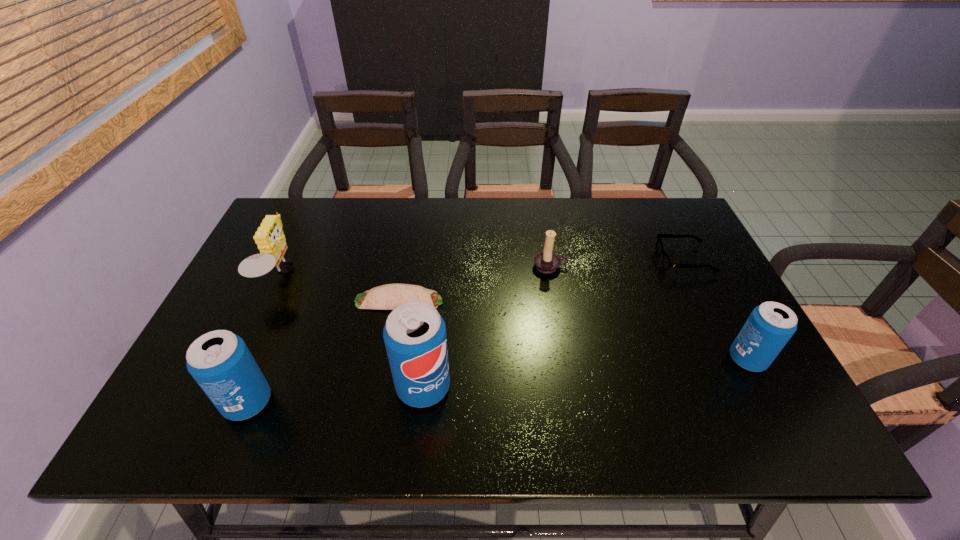
This screenshot has width=960, height=540. What are the coordinates of `the second tallest soda can` in the screenshot? It's located at pos(220,362).

In order to click on the sixth shortest object in this screenshot , I will do `click(220, 362)`.

Where is `the second soda can from right to left`? the second soda can from right to left is located at coordinates (415, 338).

I want to click on the rightmost soda can, so click(769, 327).

Where is `the shortest object`? the shortest object is located at coordinates click(390, 296).

At what (x,y) coordinates should I click in order to perform the action: click on sponge. Please return your answer as a coordinate pair (x, y). Looking at the image, I should click on (269, 237).

In order to click on the fifth object from left to right in this screenshot , I will do `click(547, 262)`.

Identify the location of the sixth tallest object. The height and width of the screenshot is (540, 960). (666, 261).

Locate an element on the screen. free space located on the left of the second shortest soda can is located at coordinates (187, 402).

Where is `vacant space located 0.240m on the back of the second soda can from right to left`? vacant space located 0.240m on the back of the second soda can from right to left is located at coordinates (434, 290).